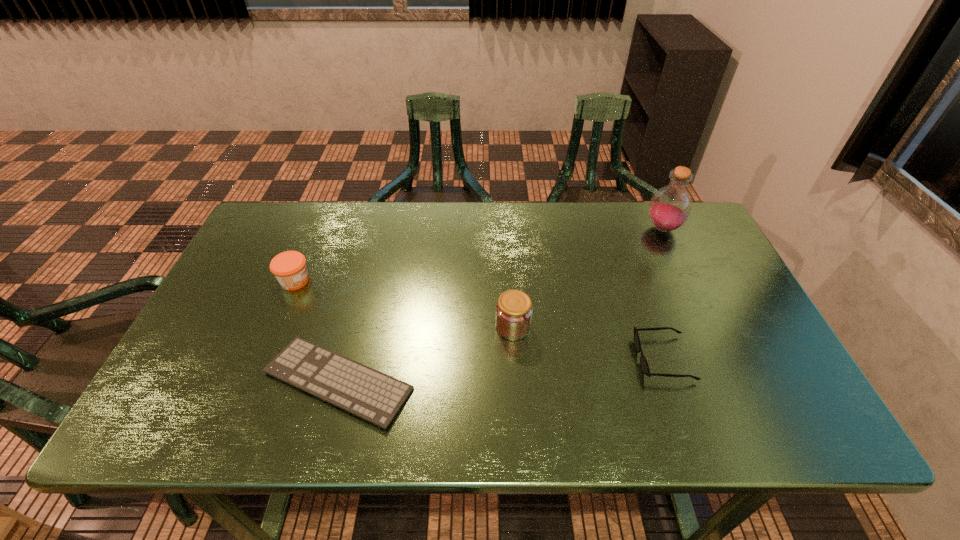
This screenshot has width=960, height=540. Find the location of `object present at the far right corner`. object present at the far right corner is located at coordinates (670, 207).

You are a GUI agent. You are given a task and a screenshot of the screen. Output one action in this format:
    pyautogui.click(x=<x>, y=<y>)
    Task: Click on the free space at the far edge
    The width and height of the screenshot is (960, 540).
    Given the screenshot: What is the action you would take?
    pyautogui.click(x=554, y=222)

Find the location of a particular element. This screenshot has height=540, width=960. vacant region at the near edge of the desktop is located at coordinates (437, 423).

You are a GUI agent. You are given a task and a screenshot of the screen. Output one action in this format:
    pyautogui.click(x=<x>, y=<y>)
    Task: Click on the vacant space at the left edge of the desktop
    The height and width of the screenshot is (540, 960).
    Given the screenshot: What is the action you would take?
    pyautogui.click(x=244, y=310)

The image size is (960, 540). What are the coordinates of `vacant space at the near left corner` in the screenshot? It's located at (182, 403).

You are a GUI agent. You are given a task and a screenshot of the screen. Output one action in this format:
    pyautogui.click(x=<x>, y=<y>)
    Task: Click on the free region at the far right corner of the desktop
    Image resolution: width=960 pixels, height=540 pixels.
    Given the screenshot: What is the action you would take?
    pyautogui.click(x=714, y=245)

I want to click on vacant space that is in between the computer keyboard and the nearer jam, so click(425, 354).

Locate an element on the screen. The image size is (960, 540). free space between the second shortest object and the shortest object is located at coordinates (501, 369).

Find the location of a particular element. vacant space in between the shortest object and the second object from right to left is located at coordinates (501, 369).

What are the coordinates of `free point between the fourth shortest object and the second farthest object` in the screenshot? It's located at (404, 304).